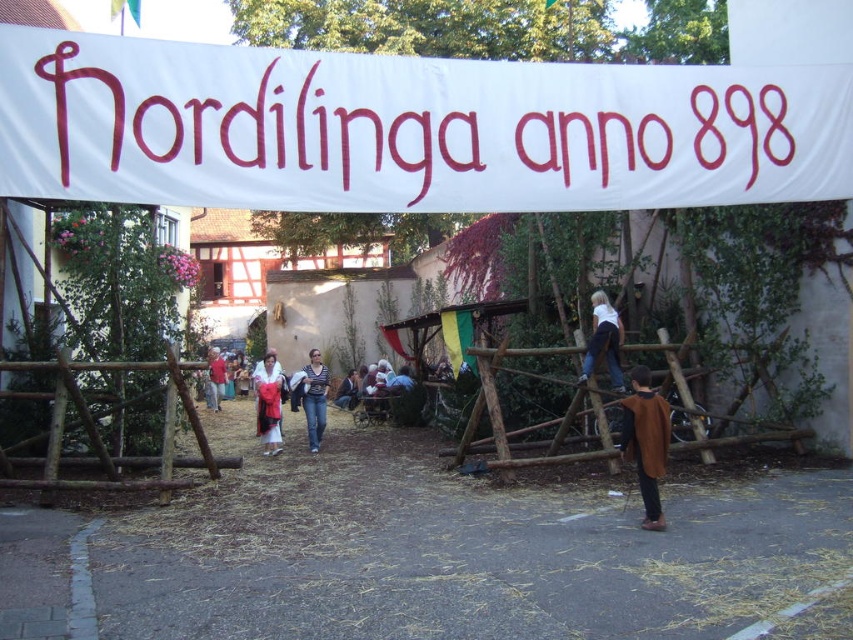
You are organizing a small event in the area and need to place a 30 feet long table between the matte red dress at center and the red shirt at center. Will there be enough space between them to fit the table?

The distance between the matte red dress at center and the red shirt at center is 35.78 feet. Since the table is 30 feet long, there is enough space to place the table between them.

You are standing at the point marked as point (x=601, y=349) in the scene. A friend is located exactly where you are viewing from. How far apart are you from your friend?

The distance between you and your friend is 10.57 meters, as the point (x=601, y=349) is 10.57 meters away from the viewer.